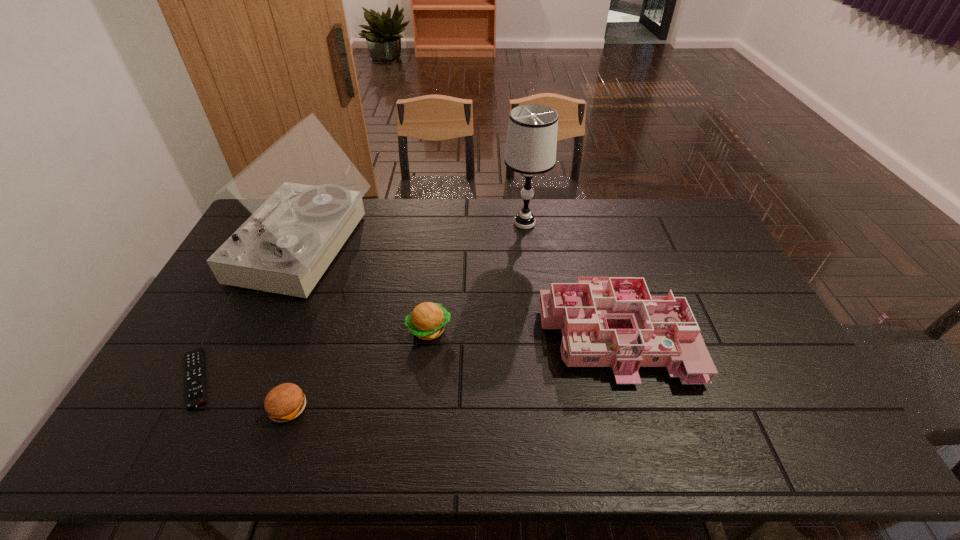
Locate an element on the screen. The image size is (960, 540). vacant space situated 0.150m at the front entrance of the fourth shortest object is located at coordinates (644, 446).

The width and height of the screenshot is (960, 540). Identify the location of free region located 0.100m on the back of the fourth object from left to right. (433, 289).

Where is `vacant space positioned 0.190m on the left of the left hamburger`? The image size is (960, 540). vacant space positioned 0.190m on the left of the left hamburger is located at coordinates (192, 407).

Where is `vacant area situated 0.060m on the front of the remote control`? The width and height of the screenshot is (960, 540). vacant area situated 0.060m on the front of the remote control is located at coordinates (166, 434).

Where is `table lamp at the far edge`? table lamp at the far edge is located at coordinates (531, 143).

This screenshot has width=960, height=540. I want to click on record player that is positioned at the far edge, so pyautogui.click(x=305, y=195).

Image resolution: width=960 pixels, height=540 pixels. Find the location of `object that is positioned at the near edge`. object that is positioned at the near edge is located at coordinates (285, 402).

Identify the location of record player at the left edge. (305, 195).

Image resolution: width=960 pixels, height=540 pixels. I want to click on remote control that is at the left edge, so click(x=195, y=382).

Image resolution: width=960 pixels, height=540 pixels. I want to click on object that is at the far left corner, so click(305, 195).